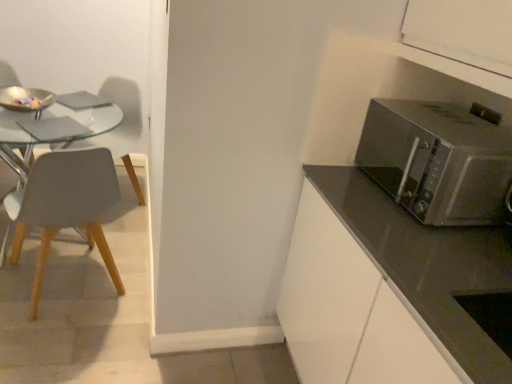
Question: Is matte gray chair at left, which appears as the 1th chair when viewed from the front, turned away from satin silver microwave at right?

Choices:
 (A) no
 (B) yes

Answer: (A)

Question: From the image's perspective, is matte gray chair at left, the 2th chair viewed from the back, on top of satin silver microwave at right?

Choices:
 (A) no
 (B) yes

Answer: (A)

Question: From the image's perspective, is matte gray chair at left, the 2th chair viewed from the back, beneath satin silver microwave at right?

Choices:
 (A) no
 (B) yes

Answer: (B)

Question: Is matte gray chair at left, which appears as the 1th chair when viewed from the front, next to satin silver microwave at right and touching it?

Choices:
 (A) no
 (B) yes

Answer: (A)

Question: Can you confirm if matte gray chair at left, which appears as the 1th chair when viewed from the front, is wider than satin silver microwave at right?

Choices:
 (A) no
 (B) yes

Answer: (B)

Question: Is matte gray chair at left, which is counted as the 2th chair, starting from the front, situated inside matte gray chair at left, the 2th chair viewed from the back, or outside?

Choices:
 (A) inside
 (B) outside

Answer: (B)

Question: Does point (129, 92) appear closer or farther from the camera than point (90, 246)?

Choices:
 (A) farther
 (B) closer

Answer: (A)

Question: From a real-world perspective, is matte gray chair at left, placed as the 1th chair when sorted from back to front, physically located above or below matte gray chair at left, the 2th chair viewed from the back?

Choices:
 (A) below
 (B) above

Answer: (B)

Question: Visually, is matte gray chair at left, placed as the 1th chair when sorted from back to front, positioned to the left or to the right of matte gray chair at left, the 2th chair viewed from the back?

Choices:
 (A) left
 (B) right

Answer: (A)

Question: Is point (374, 115) closer or farther from the camera than point (55, 170)?

Choices:
 (A) farther
 (B) closer

Answer: (B)

Question: From the image's perspective, is satin silver microwave at right positioned above or below matte gray chair at left, which appears as the 1th chair when viewed from the front?

Choices:
 (A) above
 (B) below

Answer: (A)

Question: Considering the positions of satin silver microwave at right and matte gray chair at left, the 2th chair viewed from the back, in the image, is satin silver microwave at right bigger or smaller than matte gray chair at left, the 2th chair viewed from the back,?

Choices:
 (A) small
 (B) big

Answer: (A)

Question: Is satin silver microwave at right in front of or behind matte gray chair at left, the 2th chair viewed from the back, in the image?

Choices:
 (A) behind
 (B) front

Answer: (B)

Question: Looking at their shapes, would you say satin silver microwave at right is wider or thinner than matte gray chair at left, placed as the 1th chair when sorted from back to front?

Choices:
 (A) wide
 (B) thin

Answer: (B)

Question: Relative to matte gray chair at left, which is counted as the 2th chair, starting from the front, is satin silver microwave at right in front or behind?

Choices:
 (A) behind
 (B) front

Answer: (B)